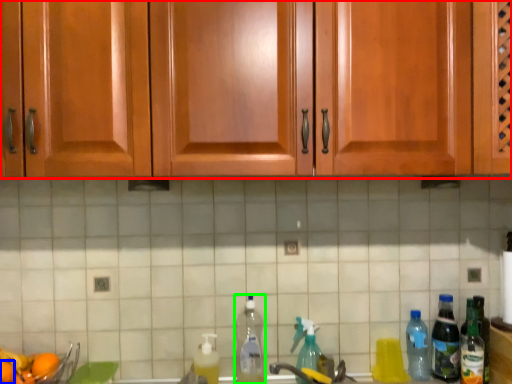
Question: Which is nearer to the cabinetry (highlighted by a red box)? orange (highlighted by a blue box) or bottle (highlighted by a green box).

Choices:
 (A) orange
 (B) bottle

Answer: (B)